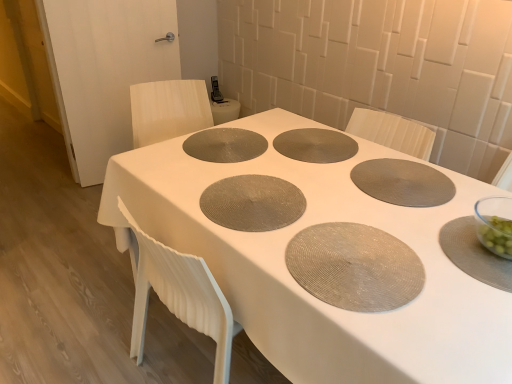
Where is `vacant space in front of matte gray placemat at center, the 1th oval from the top`? This screenshot has width=512, height=384. vacant space in front of matte gray placemat at center, the 1th oval from the top is located at coordinates (203, 170).